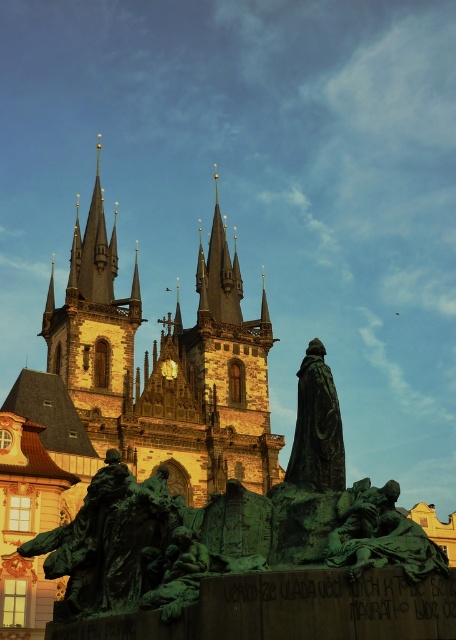
Does golden stone spires at upper left appear under green patinated bronze statue at center?

No.

Which is more to the left, golden stone spires at upper left or green patinated bronze statue at center?

golden stone spires at upper left

The image size is (456, 640). I want to click on golden stone spires at upper left, so click(x=93, y=317).

How distant is bronze statue at center from polished gold spire at center?

They are 279.13 feet apart.

This screenshot has height=640, width=456. Describe the element at coordinates (316, 428) in the screenshot. I see `bronze statue at center` at that location.

Find the location of `bronze statue at center`. bronze statue at center is located at coordinates (316, 428).

Is green patinated bronze statue at center smaller than polished gold spire at center?

Actually, green patinated bronze statue at center might be larger than polished gold spire at center.

Between green patinated bronze statue at center and polished gold spire at center, which one is positioned higher?

polished gold spire at center

Does point (405, 536) come farther from viewer compared to point (238, 321)?

That is False.

At what (x,y) coordinates should I click in order to perform the action: click on green patinated bronze statue at center. Please return your answer as a coordinate pair (x, y). Looking at the image, I should click on (379, 534).